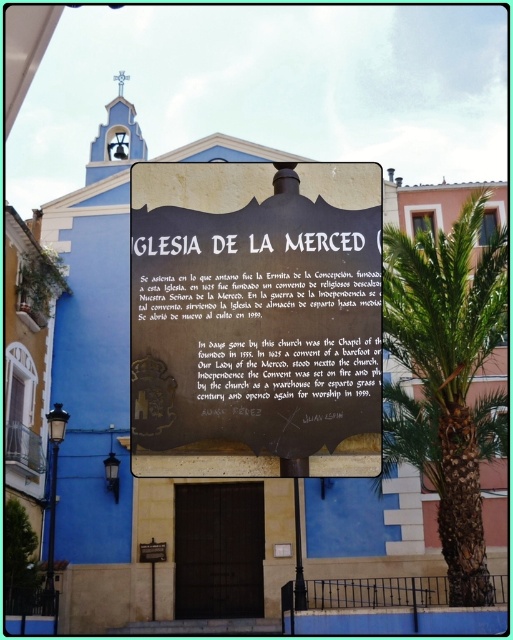
Between green leafy palm tree at right and metallic plaque at lower center, which one is positioned lower?

metallic plaque at lower center

Is green leafy palm tree at right to the right of metallic plaque at lower center from the viewer's perspective?

Correct, you'll find green leafy palm tree at right to the right of metallic plaque at lower center.

The height and width of the screenshot is (640, 513). What do you see at coordinates (449, 365) in the screenshot?
I see `green leafy palm tree at right` at bounding box center [449, 365].

Where is `green leafy palm tree at right`? green leafy palm tree at right is located at coordinates (449, 365).

Can you confirm if black polished stone sign at center is bigger than metallic plaque at lower center?

Correct, black polished stone sign at center is larger in size than metallic plaque at lower center.

The width and height of the screenshot is (513, 640). What do you see at coordinates (254, 320) in the screenshot? I see `black polished stone sign at center` at bounding box center [254, 320].

Locate an element on the screen. The height and width of the screenshot is (640, 513). black polished stone sign at center is located at coordinates (254, 320).

Between black polished stone sign at center and green leafy palm tree at right, which one appears on the left side from the viewer's perspective?

Positioned to the left is black polished stone sign at center.

Is black polished stone sign at center bigger than green leafy palm tree at right?

No, black polished stone sign at center is not bigger than green leafy palm tree at right.

The image size is (513, 640). Find the location of `black polished stone sign at center`. black polished stone sign at center is located at coordinates coord(254,320).